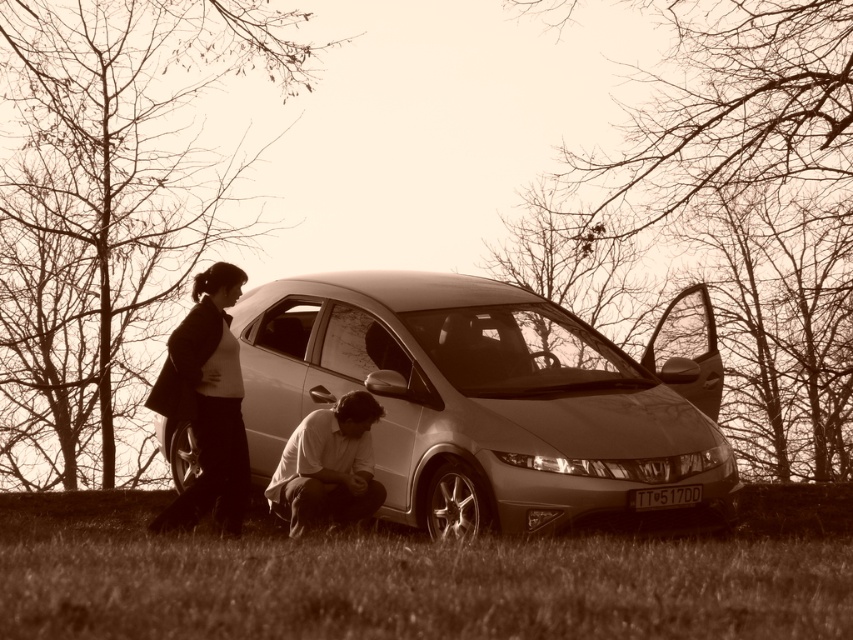
What do you see at coordinates (421, 577) in the screenshot?
I see `green grass at lower center` at bounding box center [421, 577].

Which is behind, point (405, 627) or point (195, 504)?

The point (195, 504) is behind.

Locate an element on the screen. Image resolution: width=853 pixels, height=640 pixels. green grass at lower center is located at coordinates (421, 577).

Can you confirm if satin silver car at center is wider than matte black jacket at left?

Indeed, satin silver car at center has a greater width compared to matte black jacket at left.

Which is above, satin silver car at center or matte black jacket at left?

matte black jacket at left is higher up.

Find the location of a particular element. This screenshot has width=853, height=640. satin silver car at center is located at coordinates (488, 397).

Measure the distance between matte black jacket at left and matte white shirt at lower center.

matte black jacket at left is 29.09 inches from matte white shirt at lower center.

Can you confirm if matte black jacket at left is positioned below matte white shirt at lower center?

Incorrect, matte black jacket at left is not positioned below matte white shirt at lower center.

Locate an element on the screen. The image size is (853, 640). matte black jacket at left is located at coordinates tap(206, 403).

Where is `matte black jacket at left`? matte black jacket at left is located at coordinates (206, 403).